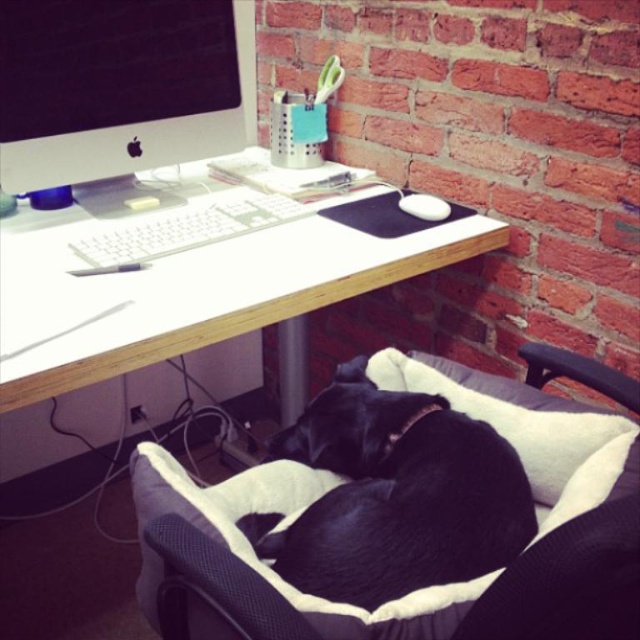
You are a delivery robot with a package that needs to be placed on the white wood computer desk at center. The robot has a 30 cm wide arm. Can the robot reach the desk from the black soft dog at lower right without moving the dog?

The distance between the white wood computer desk at center and the black soft dog at lower right is 29.50 centimeters. Since the robot arm is 30 cm wide, it can extend to reach the desk while keeping the dog undisturbed.